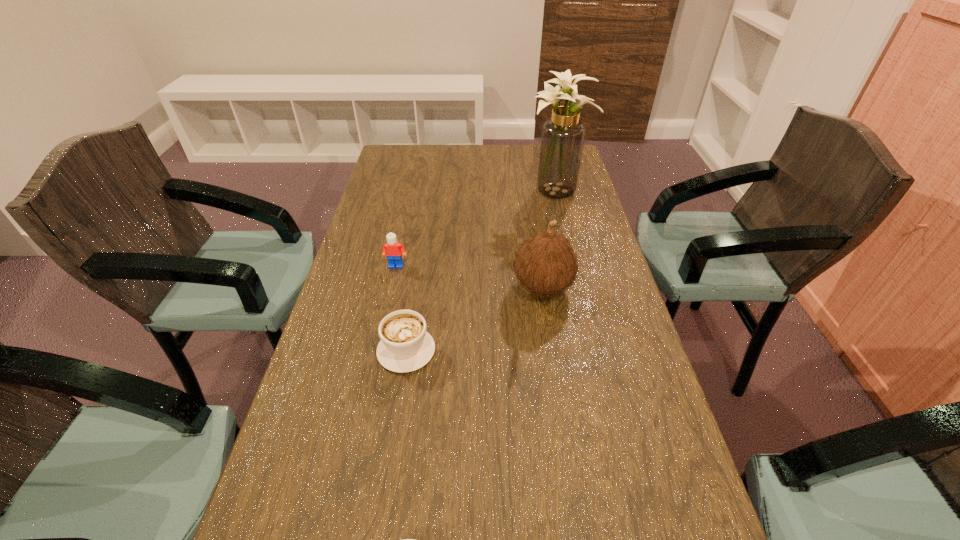
You are a GUI agent. You are given a task and a screenshot of the screen. Output one action in this format:
    pyautogui.click(x=<x>, y=<y>)
    Task: Click on the flower arrangement
    The width and height of the screenshot is (960, 540).
    Given the screenshot: What is the action you would take?
    pyautogui.click(x=562, y=140)

Where is `the tallest object`? The width and height of the screenshot is (960, 540). the tallest object is located at coordinates (562, 140).

Locate an element on the screen. the fourth shortest object is located at coordinates (546, 264).

I want to click on the third tallest object, so click(394, 251).

Find the location of a particular element. the fourth tallest object is located at coordinates (405, 346).

Where is `the farther cappuccino`? The width and height of the screenshot is (960, 540). the farther cappuccino is located at coordinates (405, 346).

Locate an element on the screen. This screenshot has width=960, height=540. free space located on the front of the tallest object is located at coordinates 564,224.

Image resolution: width=960 pixels, height=540 pixels. What are the coordinates of `free location located on the surface of the coconut` in the screenshot? It's located at (368, 287).

Image resolution: width=960 pixels, height=540 pixels. I want to click on free space located 0.160m on the surface of the coconut, so click(x=451, y=287).

Where is `vacant region located on the surface of the coconut`? vacant region located on the surface of the coconut is located at coordinates (436, 287).